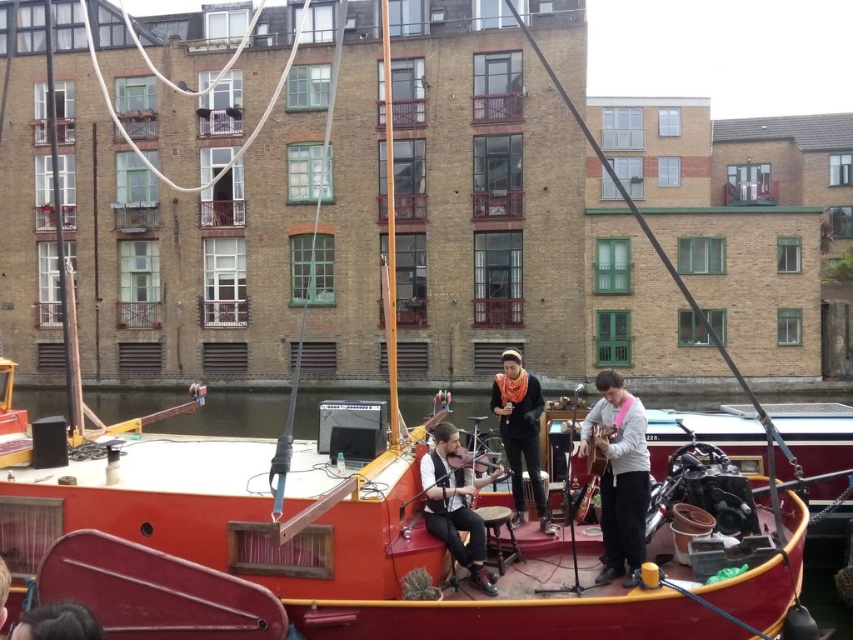
You are a photographer on the canal and want to capture both the black leather jacket at center and the wooden acoustic guitar at center in your shot. Which object should you focus on first to ensure it appears larger in the photo?

The black leather jacket at center has a greater height compared to the wooden acoustic guitar at center, so focusing on the black leather jacket at center first will ensure it appears larger in the photo.

You are a photographer trying to capture a closeup shot of the wooden acoustic guitar at center. You want to ensure that the black leather jacket at center does not block the view. Based on the scene, can you determine if the jacket is wider than the guitar?

The black leather jacket at center might be wider than wooden acoustic guitar at center, so there is a possibility that the jacket could block the view of the guitar. Adjust your position to ensure the guitar is fully visible.

You are a photographer on a nearby bridge, and you want to capture both the smooth wooden boat at center and the wooden acoustic guitar at center in your photo. Based on their positions, which object should you focus on first to ensure both are in the frame?

The smooth wooden boat at center is located below the wooden acoustic guitar at center, so you should focus on the wooden acoustic guitar at center first to ensure both are in the frame.